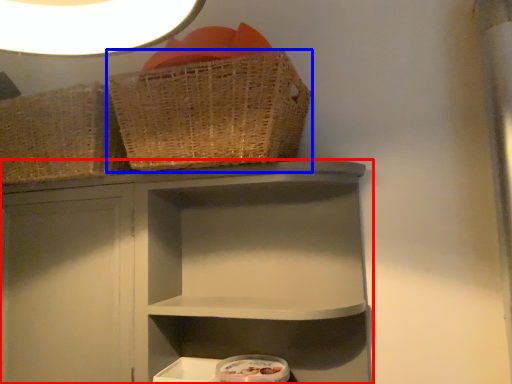
Question: Which object is closer to the camera taking this photo, shelf (highlighted by a red box) or basket (highlighted by a blue box)?

Choices:
 (A) shelf
 (B) basket

Answer: (B)